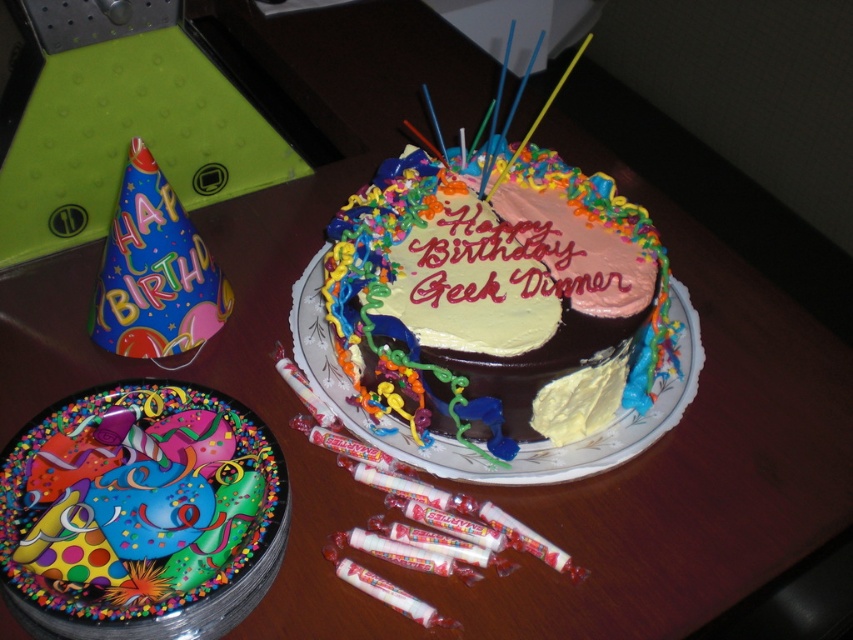
You are a guest at the birthday party and want to blow out the candles on the chocolate frosted cake at center. However, you notice the yellow matte frosting at center in the way. Can you reach the cake without moving the frosting?

The chocolate frosted cake at center is in front of the yellow matte frosting at center, so you can reach the cake without moving the frosting because it is closer to you.

You are a guest at the birthday party and want to place a candle on the cake. According to the image, where should you place the candle in relation to the decorative paper plate at center and the yellow matte frosting at center?

The decorative paper plate at center is located below the yellow matte frosting at center, so you should place the candle on the yellow matte frosting at center which is above the decorative paper plate at center.

You are holding a balloon that needs to be placed exactly 30 inches away from the decorative paper plate at center. Based on the scene described, is there enough space between you and the plate to place the balloon at the required distance?

The distance between the decorative paper plate at center and the viewer is 28.35 inches. Since the balloon needs to be placed 30 inches away from the plate, you are currently too close. You need to move back approximately 1.65 inches to achieve the required distance.